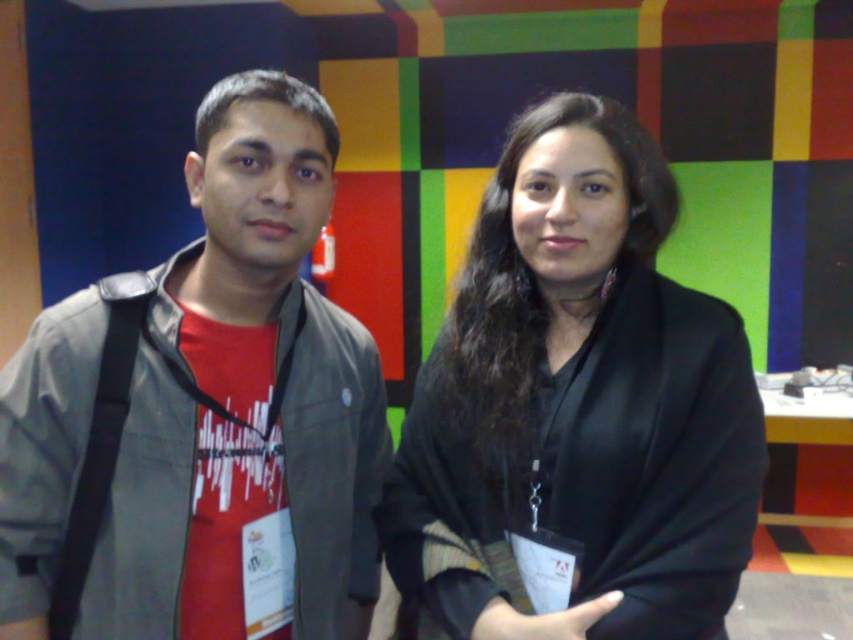
Can you confirm if matte gray jacket at left is wider than black matte/black fabric at center?

No, matte gray jacket at left is not wider than black matte/black fabric at center.

Is point (387, 460) closer to viewer compared to point (619, 264)?

No.

I want to click on matte gray jacket at left, so click(207, 416).